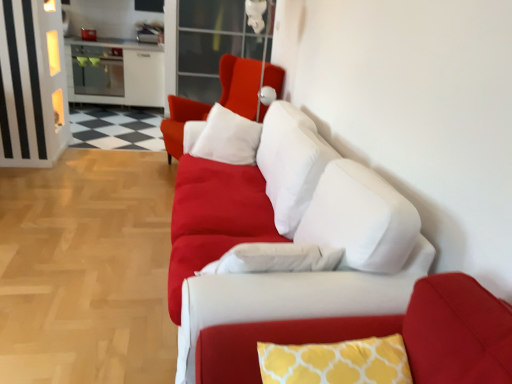
Question: Does matte white cushion at center have a lesser height compared to white glossy cabinet at upper left?

Choices:
 (A) yes
 (B) no

Answer: (B)

Question: Is matte white cushion at center taller than white glossy cabinet at upper left?

Choices:
 (A) yes
 (B) no

Answer: (A)

Question: From a real-world perspective, is matte white cushion at center located higher than white glossy cabinet at upper left?

Choices:
 (A) no
 (B) yes

Answer: (B)

Question: Is matte white cushion at center positioned with its back to white glossy cabinet at upper left?

Choices:
 (A) no
 (B) yes

Answer: (A)

Question: Can we say matte white cushion at center lies outside white glossy cabinet at upper left?

Choices:
 (A) yes
 (B) no

Answer: (A)

Question: Is matte white cushion at center to the right of white glossy cabinet at upper left from the viewer's perspective?

Choices:
 (A) yes
 (B) no

Answer: (A)

Question: Is matte white couch at center shorter than matte white cushion at center?

Choices:
 (A) no
 (B) yes

Answer: (B)

Question: Is matte white couch at center further to the viewer compared to matte white cushion at center?

Choices:
 (A) no
 (B) yes

Answer: (A)

Question: Is matte white couch at center positioned beyond the bounds of matte white cushion at center?

Choices:
 (A) no
 (B) yes

Answer: (B)

Question: Does matte white couch at center have a larger size compared to matte white cushion at center?

Choices:
 (A) no
 (B) yes

Answer: (B)

Question: Is matte white couch at center closer to the viewer compared to matte white cushion at center?

Choices:
 (A) yes
 (B) no

Answer: (A)

Question: Is matte white couch at center wider than matte white cushion at center?

Choices:
 (A) no
 (B) yes

Answer: (B)

Question: From the image's perspective, is yellow printed cushion at center on top of transparent glass door at upper center?

Choices:
 (A) yes
 (B) no

Answer: (B)